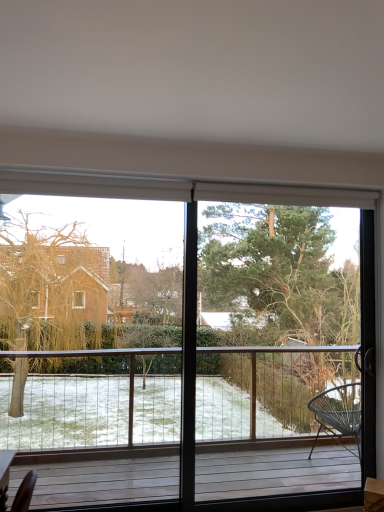
Describe the element at coordinates (196, 248) in the screenshot. I see `transparent glass window at center` at that location.

The image size is (384, 512). I want to click on transparent glass window at center, so click(196, 248).

What do you see at coordinates (272, 318) in the screenshot? This screenshot has height=512, width=384. I see `green textured tree at center` at bounding box center [272, 318].

Where is `green textured tree at center`? green textured tree at center is located at coordinates (272, 318).

Identify the location of transparent glass window at center. The height and width of the screenshot is (512, 384). (196, 248).

Considering the positions of objects green textured tree at center and transparent glass window at center in the image provided, who is more to the right, green textured tree at center or transparent glass window at center?

Positioned to the right is green textured tree at center.

Relative to transparent glass window at center, is green textured tree at center in front or behind?

Clearly, green textured tree at center is behind transparent glass window at center.

Between point (274, 367) and point (187, 298), which one is positioned behind?

Point (274, 367)

From the image's perspective, is green textured tree at center above transparent glass window at center?

Yes, from the image's perspective, green textured tree at center is above transparent glass window at center.

From a real-world perspective, is green textured tree at center positioned above or below transparent glass window at center?

From a real-world perspective, green textured tree at center is physically above transparent glass window at center.

Does green textured tree at center have a greater width compared to transparent glass window at center?

Indeed, green textured tree at center has a greater width compared to transparent glass window at center.

Is green textured tree at center taller or shorter than transparent glass window at center?

green textured tree at center is taller than transparent glass window at center.

Looking at the image, does green textured tree at center seem bigger or smaller compared to transparent glass window at center?

In the image, green textured tree at center appears to be larger than transparent glass window at center.

Based on the photo, is green textured tree at center spatially inside transparent glass window at center, or outside of it?

green textured tree at center is enclosed within transparent glass window at center.

Is green textured tree at center beside transparent glass window at center?

No, green textured tree at center is not with transparent glass window at center.

Does green textured tree at center turn towards transparent glass window at center?

Yes.

Can you tell me how much green textured tree at center and transparent glass window at center differ in facing direction?

There is a 0.000371-degree angle between the facing directions of green textured tree at center and transparent glass window at center.

Locate an element on the screen. window in front of the green textured tree at center is located at coordinates (196, 248).

Between transparent glass window at center and green textured tree at center, which one appears on the left side from the viewer's perspective?

transparent glass window at center.

Does transparent glass window at center lie in front of green textured tree at center?

That is True.

Looking at this image, which point is more forward, (x=374, y=276) or (x=343, y=371)?

The point (x=374, y=276) is closer.

From the image's perspective, between transparent glass window at center and green textured tree at center, who is located below?

From the image's view, transparent glass window at center is below.

From a real-world perspective, does transparent glass window at center stand above green textured tree at center?

No, from a real-world perspective, transparent glass window at center is not above green textured tree at center.

Between transparent glass window at center and green textured tree at center, which one has smaller width?

transparent glass window at center is thinner.

Considering the sizes of transparent glass window at center and green textured tree at center in the image, is transparent glass window at center taller or shorter than green textured tree at center?

transparent glass window at center is shorter than green textured tree at center.

Who is smaller, transparent glass window at center or green textured tree at center?

transparent glass window at center is smaller.

Is green textured tree at center inside transparent glass window at center?

Yes, green textured tree at center can be found within transparent glass window at center.

Is transparent glass window at center directly adjacent to green textured tree at center?

No, transparent glass window at center is not in contact with green textured tree at center.

Is transparent glass window at center oriented towards green textured tree at center?

Yes, transparent glass window at center is facing green textured tree at center.

Can you tell me how much transparent glass window at center and green textured tree at center differ in facing direction?

0.000371 degrees.

In the scene shown: How far apart are transparent glass window at center and green textured tree at center?

transparent glass window at center and green textured tree at center are 8.53 feet apart.

Where is `tree lying above the transparent glass window at center (from the image's perspective)`? The width and height of the screenshot is (384, 512). tree lying above the transparent glass window at center (from the image's perspective) is located at coordinates (272, 318).

Where is `tree that is above the transparent glass window at center (from the image's perspective)`? The width and height of the screenshot is (384, 512). tree that is above the transparent glass window at center (from the image's perspective) is located at coordinates (272, 318).

The width and height of the screenshot is (384, 512). Identify the location of window located on the left of green textured tree at center. click(196, 248).